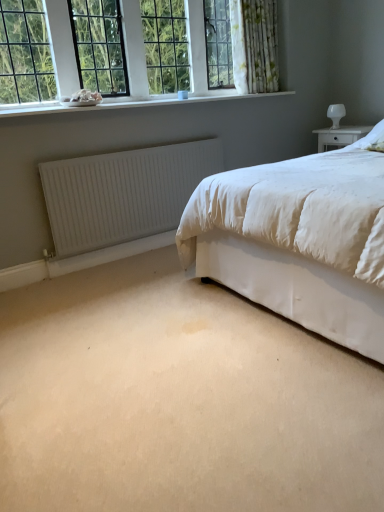
Question: From the image's perspective, is white matte radiator at lower left located beneath clear glass window at upper left?

Choices:
 (A) yes
 (B) no

Answer: (A)

Question: Is white matte radiator at lower left aimed at clear glass window at upper left?

Choices:
 (A) no
 (B) yes

Answer: (A)

Question: Considering the relative positions of white matte radiator at lower left and clear glass window at upper left in the image provided, is white matte radiator at lower left in front of clear glass window at upper left?

Choices:
 (A) no
 (B) yes

Answer: (A)

Question: From a real-world perspective, is white matte radiator at lower left located beneath clear glass window at upper left?

Choices:
 (A) yes
 (B) no

Answer: (A)

Question: Is white matte radiator at lower left further to the viewer compared to clear glass window at upper left?

Choices:
 (A) yes
 (B) no

Answer: (A)

Question: Considering the positions of white smooth window sill at upper left and white floral fabric curtain at upper center in the image, is white smooth window sill at upper left wider or thinner than white floral fabric curtain at upper center?

Choices:
 (A) wide
 (B) thin

Answer: (A)

Question: Looking at the image, does white smooth window sill at upper left seem bigger or smaller compared to white floral fabric curtain at upper center?

Choices:
 (A) big
 (B) small

Answer: (B)

Question: Is point (230, 94) positioned closer to the camera than point (235, 23)?

Choices:
 (A) farther
 (B) closer

Answer: (A)

Question: Considering the positions of white smooth window sill at upper left and white floral fabric curtain at upper center in the image, is white smooth window sill at upper left taller or shorter than white floral fabric curtain at upper center?

Choices:
 (A) short
 (B) tall

Answer: (A)

Question: From a real-world perspective, is white glossy table lamp at upper right positioned above or below clear glass window at upper left?

Choices:
 (A) below
 (B) above

Answer: (A)

Question: Considering their positions, is white glossy table lamp at upper right located in front of or behind clear glass window at upper left?

Choices:
 (A) front
 (B) behind

Answer: (B)

Question: Does point (329, 104) appear closer or farther from the camera than point (8, 10)?

Choices:
 (A) farther
 (B) closer

Answer: (A)

Question: Looking at the image, does white glossy table lamp at upper right seem bigger or smaller compared to clear glass window at upper left?

Choices:
 (A) small
 (B) big

Answer: (A)

Question: Considering the positions of clear glass window at upper left and white matte radiator at lower left in the image, is clear glass window at upper left wider or thinner than white matte radiator at lower left?

Choices:
 (A) wide
 (B) thin

Answer: (A)

Question: Considering the positions of clear glass window at upper left and white matte radiator at lower left in the image, is clear glass window at upper left bigger or smaller than white matte radiator at lower left?

Choices:
 (A) big
 (B) small

Answer: (A)